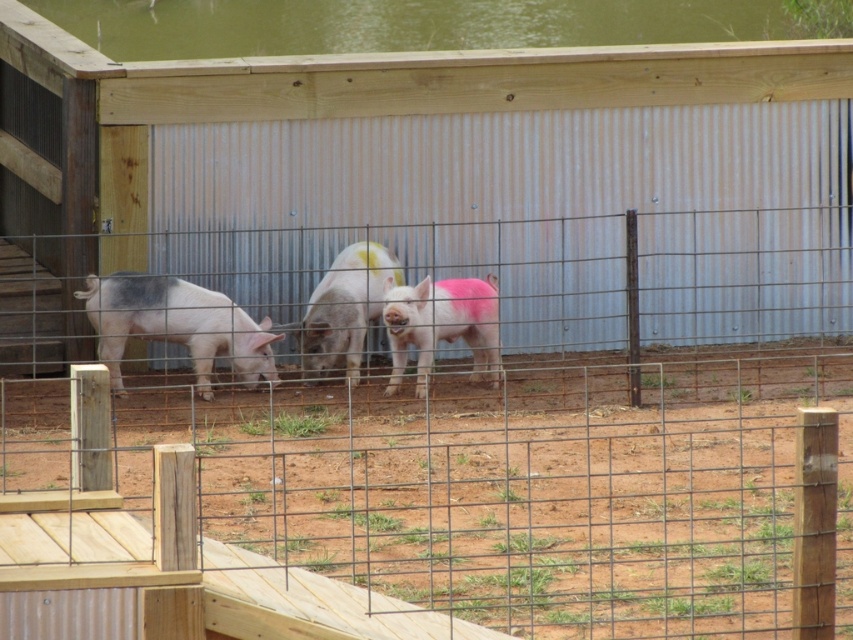
You are a farmer who wants to install a new water trough for the pigs. The trough needs to be at least as tall as the pink matte pig at center to ensure all pigs can drink comfortably. Based on the scene, is the green water at upper center suitable for this purpose?

The green water at upper center is not as tall as the pink matte pig at center, so it is not suitable for the trough since it does not meet the required height.

You are a farmer who wants to ensure the pink matte piglet at center has enough space to move around. Given that the gray matte pig at center takes up more space, can the piglet still move freely in the enclosure?

The gray matte pig at center is larger in size than the pink matte piglet at center, but the enclosure has enough space for both. The piglet can move freely as long as the gray pig isn not blocking its path.

You are a farmer checking the pigs in the fenced area. You notice a pink matte piglet at center and a pink matte pig at center. Which one is located below the other?

The pink matte piglet at center is positioned under the pink matte pig at center.